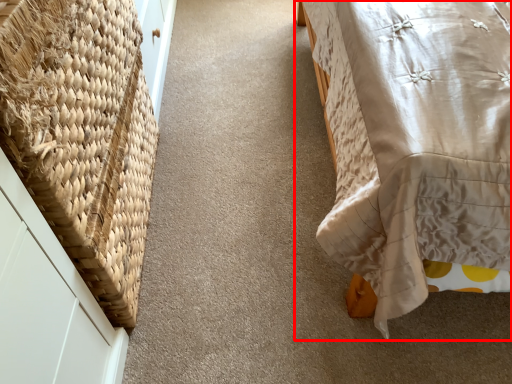
Question: From the image's perspective, what is the correct spatial positioning of furniture (annotated by the red box) in reference to basket?

Choices:
 (A) above
 (B) below

Answer: (A)